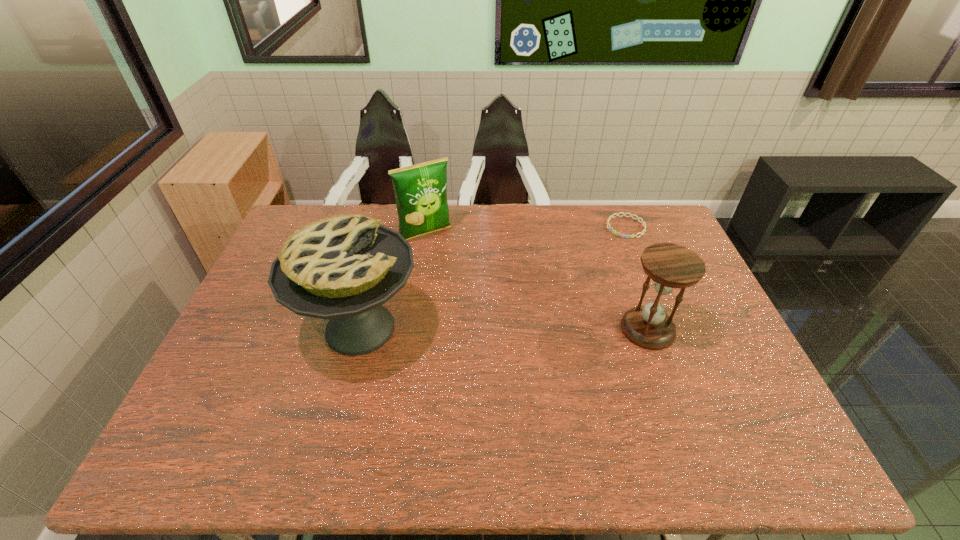
Find the location of a particular element. vacant space in between the crisp (potato chip) and the hourglass is located at coordinates (537, 282).

Choose which object is the nearest neighbor to the pie. Please provide its 2D coordinates. Your answer should be formatted as a tuple, i.e. [(x, y)], where the tuple contains the x and y coordinates of a point satisfying the conditions above.

[(420, 190)]

Image resolution: width=960 pixels, height=540 pixels. I want to click on object identified as the third closest to the pie, so click(x=644, y=225).

You are a GUI agent. You are given a task and a screenshot of the screen. Output one action in this format:
    pyautogui.click(x=<x>, y=<y>)
    Task: Click on the free point that satisfies the following two spatial constraints: 1. on the back side of the shortest object; 2. on the right side of the crisp (potato chip)
    The image size is (960, 540).
    Given the screenshot: What is the action you would take?
    pyautogui.click(x=427, y=227)